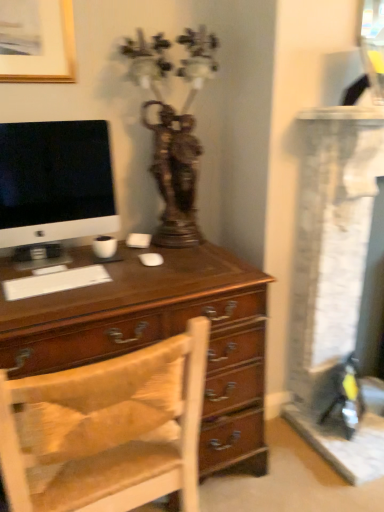
Question: From the image's perspective, does wooden chair at center appear higher than matte black monitor at left?

Choices:
 (A) yes
 (B) no

Answer: (B)

Question: From a real-world perspective, is wooden chair at center located higher than matte black monitor at left?

Choices:
 (A) yes
 (B) no

Answer: (B)

Question: Does wooden chair at center lie in front of matte black monitor at left?

Choices:
 (A) yes
 (B) no

Answer: (A)

Question: Is wooden chair at center aimed at matte black monitor at left?

Choices:
 (A) no
 (B) yes

Answer: (A)

Question: Are wooden chair at center and matte black monitor at left far apart?

Choices:
 (A) no
 (B) yes

Answer: (A)

Question: Does point (19, 176) appear closer or farther from the camera than point (31, 64)?

Choices:
 (A) closer
 (B) farther

Answer: (A)

Question: Is matte black monitor at left to the left or to the right of gold-framed picture at upper left in the image?

Choices:
 (A) left
 (B) right

Answer: (B)

Question: From a real-world perspective, is matte black monitor at left above or below gold-framed picture at upper left?

Choices:
 (A) below
 (B) above

Answer: (A)

Question: In terms of size, does matte black monitor at left appear bigger or smaller than gold-framed picture at upper left?

Choices:
 (A) big
 (B) small

Answer: (A)

Question: Is gold-framed picture at upper left wider or thinner than antique bronze statue at upper center?

Choices:
 (A) thin
 (B) wide

Answer: (A)

Question: Does point (41, 4) appear closer or farther from the camera than point (196, 242)?

Choices:
 (A) farther
 (B) closer

Answer: (B)

Question: From a real-world perspective, relative to antique bronze statue at upper center, is gold-framed picture at upper left vertically above or below?

Choices:
 (A) below
 (B) above

Answer: (B)

Question: From the image's perspective, relative to antique bronze statue at upper center, is gold-framed picture at upper left above or below?

Choices:
 (A) above
 (B) below

Answer: (A)

Question: In terms of size, does wooden chair at center appear bigger or smaller than matte black monitor at left?

Choices:
 (A) small
 (B) big

Answer: (B)

Question: Considering the positions of wooden chair at center and matte black monitor at left in the image, is wooden chair at center taller or shorter than matte black monitor at left?

Choices:
 (A) short
 (B) tall

Answer: (B)